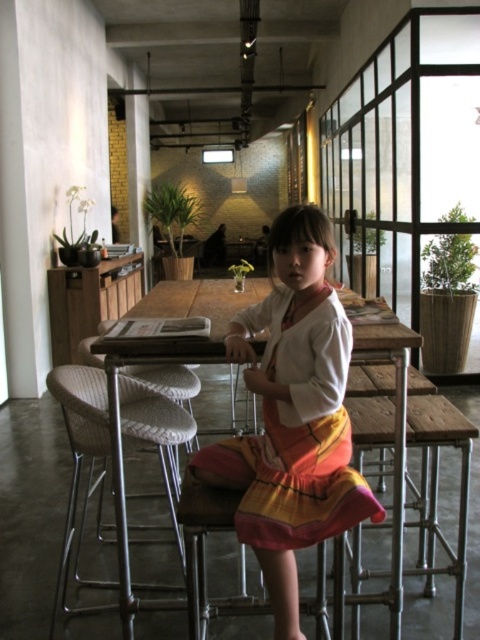
You are a photographer setting up a shoot in this industrial dining area. You need to choose between placing a model on the white fabric chair at lower left or the metallic silver bar stool at center. Which option offers more seating space for the model?

The white fabric chair at lower left is larger in size than the metallic silver bar stool at center, so it offers more seating space for the model.